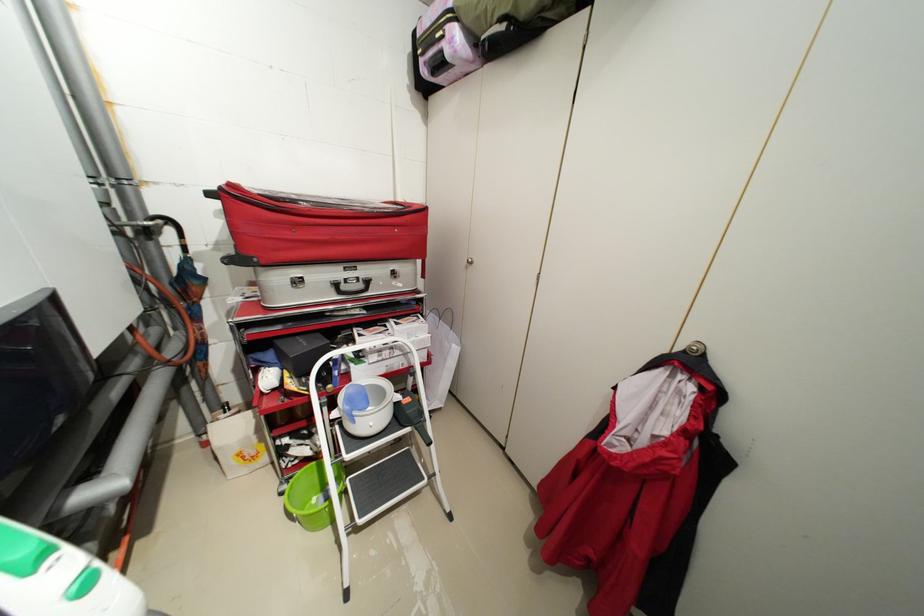
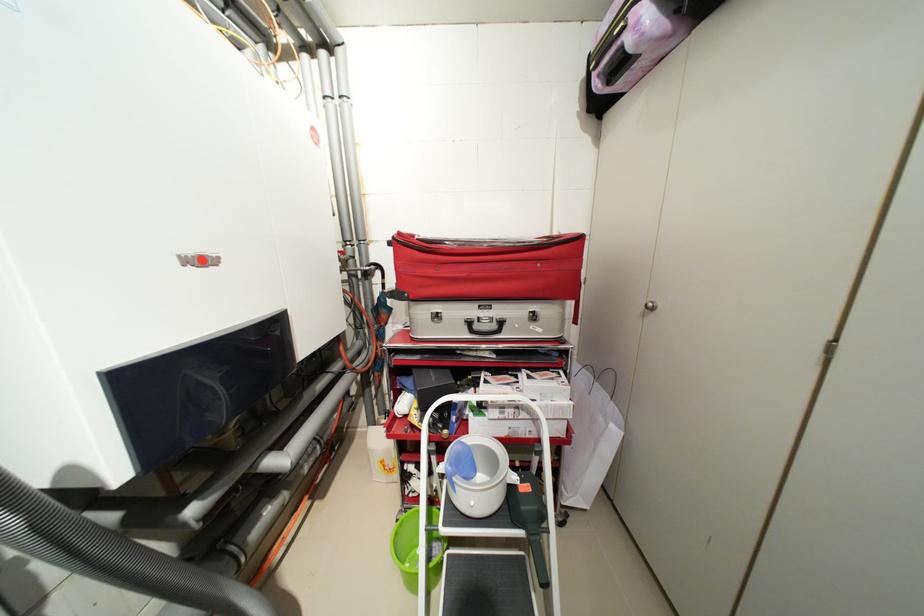
Where in the second image is the point corresponding to pixel 237 185 from the first image?

(407, 235)